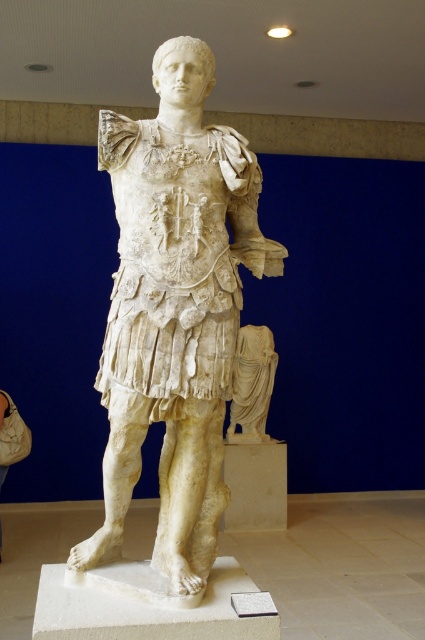
Question: Among these objects, which one is farthest from the camera?

Choices:
 (A) white marble statue at center
 (B) white marble pedestal at center
 (C) white marble draped cloth at center

Answer: (C)

Question: Which object is positioned farthest from the white marble pedestal at center?

Choices:
 (A) white marble draped cloth at center
 (B) white marble statue at center

Answer: (A)

Question: Is white marble statue at center further to the viewer compared to white marble pedestal at center?

Choices:
 (A) no
 (B) yes

Answer: (B)

Question: Which of the following is the farthest from the observer?

Choices:
 (A) (125, 358)
 (B) (189, 634)

Answer: (A)

Question: Is white marble statue at center wider than white marble pedestal at center?

Choices:
 (A) yes
 (B) no

Answer: (B)

Question: Considering the relative positions of white marble statue at center and white marble pedestal at center in the image provided, where is white marble statue at center located with respect to white marble pedestal at center?

Choices:
 (A) above
 (B) below

Answer: (A)